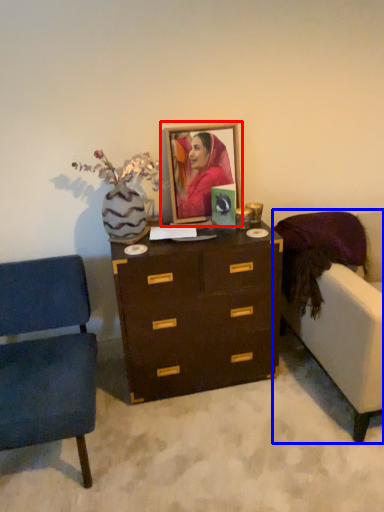
Question: Which object appears closest to the camera in this image, picture frame (highlighted by a red box) or studio couch (highlighted by a blue box)?

Choices:
 (A) picture frame
 (B) studio couch

Answer: (B)